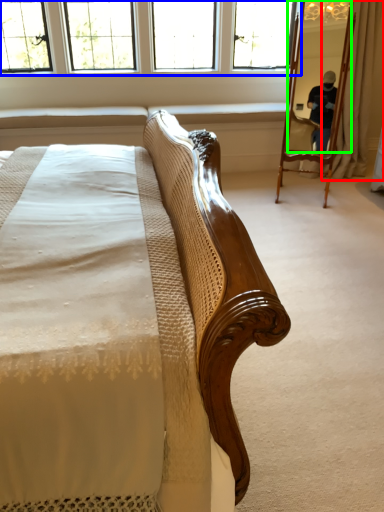
Question: Which is nearer to the curtain (highlighted by a red box)? window (highlighted by a blue box) or mirror (highlighted by a green box).

Choices:
 (A) window
 (B) mirror

Answer: (B)